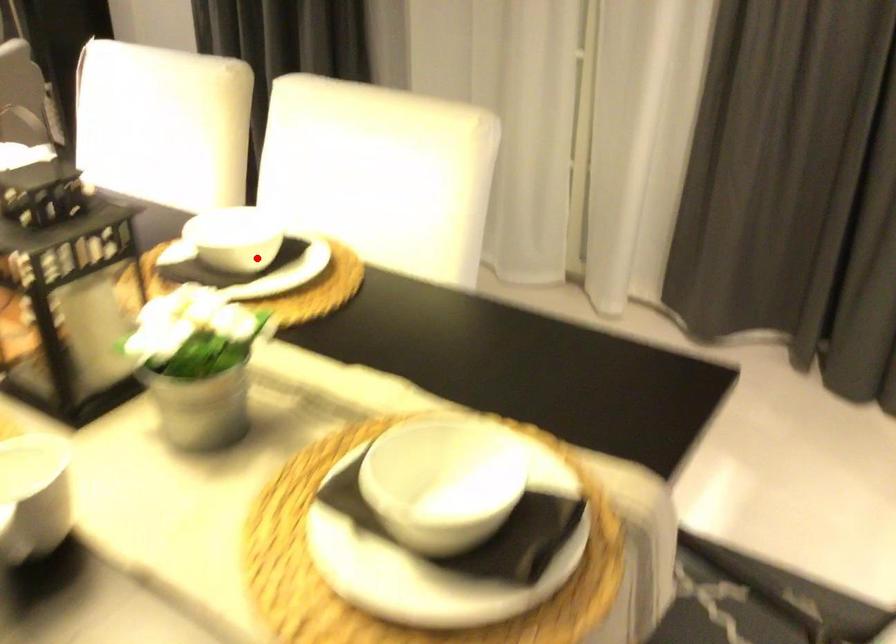
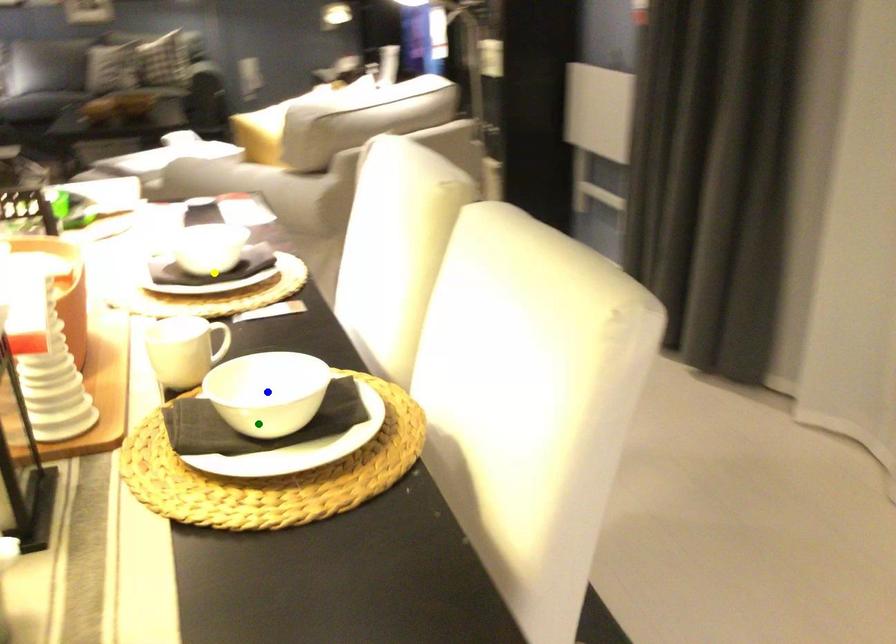
Question: I am providing you with two images of the same scene from different viewpoints. A red point is marked on the first image. You are given multiple points on the second image. Which point in image 2 represents the same 3d spot as the red point in image 1?

Choices:
 (A) blue point
 (B) yellow point
 (C) green point

Answer: (C)